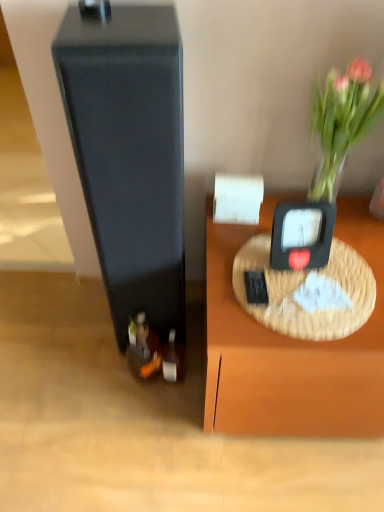
Question: From a real-world perspective, is translucent glass vase at upper right below shiny dark glass wine bottle at lower left, which is the 2th wine bottle from right to left?

Choices:
 (A) yes
 (B) no

Answer: (B)

Question: Considering the relative sizes of translucent glass vase at upper right and shiny dark glass wine bottle at lower left, the 1th wine bottle viewed from the left, in the image provided, is translucent glass vase at upper right shorter than shiny dark glass wine bottle at lower left, the 1th wine bottle viewed from the left,?

Choices:
 (A) yes
 (B) no

Answer: (B)

Question: From the image's perspective, is translucent glass vase at upper right under shiny dark glass wine bottle at lower left, which is the 2th wine bottle from right to left?

Choices:
 (A) no
 (B) yes

Answer: (A)

Question: Is translucent glass vase at upper right looking in the opposite direction of shiny dark glass wine bottle at lower left, which is the 2th wine bottle from right to left?

Choices:
 (A) no
 (B) yes

Answer: (A)

Question: Is shiny dark glass wine bottle at lower left, which is the 2th wine bottle from right to left, completely or partially inside translucent glass vase at upper right?

Choices:
 (A) yes
 (B) no

Answer: (B)

Question: From their relative heights in the image, would you say black plastic weight scale at upper right is taller or shorter than matte black speaker at left?

Choices:
 (A) tall
 (B) short

Answer: (B)

Question: From the image's perspective, relative to matte black speaker at left, is black plastic weight scale at upper right above or below?

Choices:
 (A) above
 (B) below

Answer: (B)

Question: From a real-world perspective, is black plastic weight scale at upper right positioned above or below matte black speaker at left?

Choices:
 (A) below
 (B) above

Answer: (B)

Question: Is point (311, 250) closer or farther from the camera than point (127, 227)?

Choices:
 (A) farther
 (B) closer

Answer: (A)

Question: From a real-world perspective, is shiny dark glass wine bottle at lower left, the 1th wine bottle viewed from the left, physically located above or below matte black speaker at left?

Choices:
 (A) above
 (B) below

Answer: (B)

Question: From their relative heights in the image, would you say shiny dark glass wine bottle at lower left, the 1th wine bottle viewed from the left, is taller or shorter than matte black speaker at left?

Choices:
 (A) tall
 (B) short

Answer: (B)

Question: From the image's perspective, is shiny dark glass wine bottle at lower left, the 1th wine bottle viewed from the left, positioned above or below matte black speaker at left?

Choices:
 (A) below
 (B) above

Answer: (A)

Question: In terms of width, does shiny dark glass wine bottle at lower left, the 1th wine bottle viewed from the left, look wider or thinner when compared to matte black speaker at left?

Choices:
 (A) wide
 (B) thin

Answer: (B)

Question: Visually, is shiny silver wine bottle at lower center, which is the second wine bottle in left-to-right order, positioned to the left or to the right of matte black speaker at left?

Choices:
 (A) left
 (B) right

Answer: (B)

Question: Would you say shiny silver wine bottle at lower center, which is the second wine bottle in left-to-right order, is inside or outside matte black speaker at left?

Choices:
 (A) outside
 (B) inside

Answer: (A)